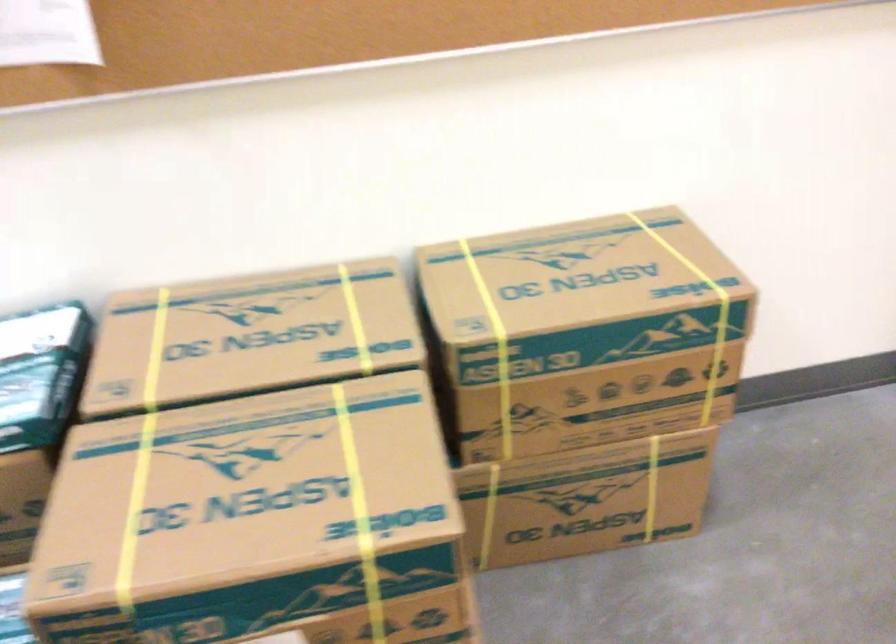
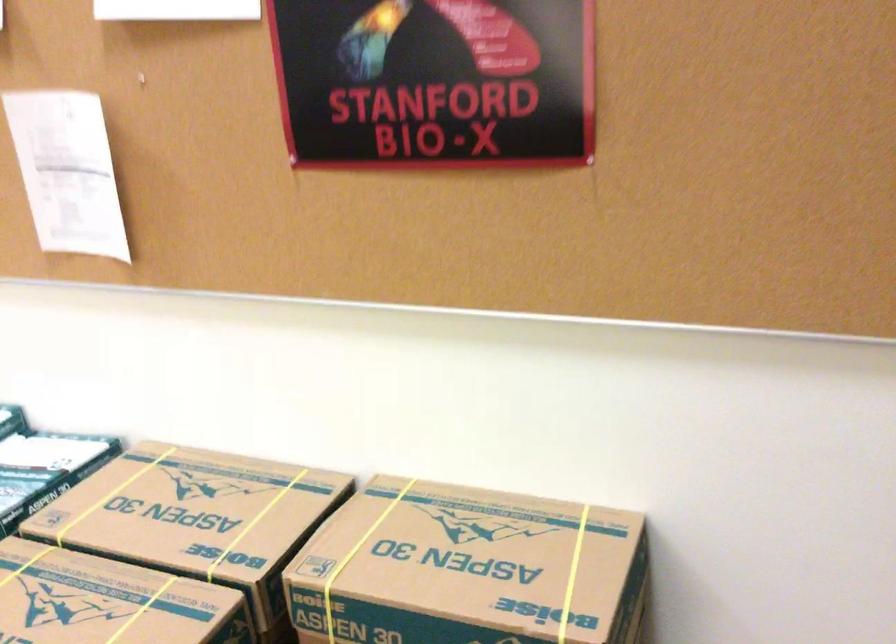
Where in the second image is the point corresponding to (340,422) from the first image?

(142, 609)